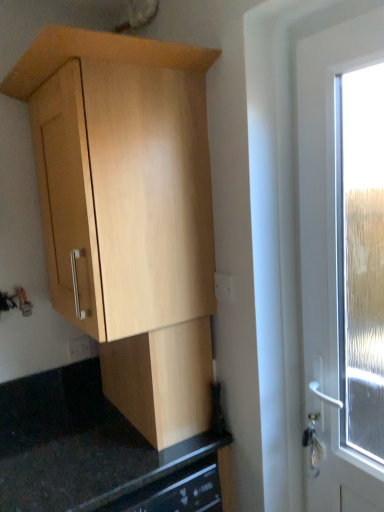
What do you see at coordinates (224, 287) in the screenshot?
I see `white plastic electric outlet at center-right, arranged as the first electric outlet when viewed from the top` at bounding box center [224, 287].

What is the approximate width of white plastic electric outlet at center-right, positioned as the second electric outlet in bottom-to-top order?

white plastic electric outlet at center-right, positioned as the second electric outlet in bottom-to-top order, is 0.61 inches in width.

Based on the photo, how much space does light wood cabinet at upper left, which ranks as the 1th cabinetry in top-to-bottom order, occupy horizontally?

47.65 centimeters.

Image resolution: width=384 pixels, height=512 pixels. I want to click on light wood cabinet at center, placed as the first cabinetry when sorted from bottom to top, so click(x=162, y=381).

I want to click on white plastic electric outlet at lower left, which is counted as the second electric outlet, starting from the top, so click(x=79, y=349).

How distant is black granite countertop at lower center from white plastic electric outlet at lower left, which is the 1th electric outlet in left-to-right order?

black granite countertop at lower center and white plastic electric outlet at lower left, which is the 1th electric outlet in left-to-right order, are 36.60 centimeters apart from each other.

From the picture: Would you say black granite countertop at lower center is inside or outside white plastic electric outlet at lower left, acting as the 2th electric outlet starting from the right?

black granite countertop at lower center cannot be found inside white plastic electric outlet at lower left, acting as the 2th electric outlet starting from the right.

Is black granite countertop at lower center wider or thinner than white plastic electric outlet at lower left, the second electric outlet in the front-to-back sequence?

black granite countertop at lower center is wider than white plastic electric outlet at lower left, the second electric outlet in the front-to-back sequence.

From a real-world perspective, is black granite countertop at lower center physically located above or below light wood cabinet at upper left, which ranks as the 1th cabinetry in top-to-bottom order?

Clearly, from a real-world perspective, black granite countertop at lower center is below light wood cabinet at upper left, which ranks as the 1th cabinetry in top-to-bottom order.

Is black granite countertop at lower center wider or thinner than light wood cabinet at upper left, which ranks as the 1th cabinetry in top-to-bottom order?

Considering their sizes, black granite countertop at lower center looks broader than light wood cabinet at upper left, which ranks as the 1th cabinetry in top-to-bottom order.

Locate an element on the screen. the 2nd cabinetry above the black granite countertop at lower center (from a real-world perspective) is located at coordinates (128, 213).

Which of these two, light wood cabinet at center, placed as the first cabinetry when sorted from bottom to top, or black granite countertop at lower center, is smaller?

light wood cabinet at center, placed as the first cabinetry when sorted from bottom to top.

Considering the sizes of objects light wood cabinet at center, placed as the first cabinetry when sorted from bottom to top, and black granite countertop at lower center in the image provided, who is thinner, light wood cabinet at center, placed as the first cabinetry when sorted from bottom to top, or black granite countertop at lower center?

light wood cabinet at center, placed as the first cabinetry when sorted from bottom to top, is thinner.

Is light wood cabinet at center, the second cabinetry positioned from the top, with black granite countertop at lower center?

No, light wood cabinet at center, the second cabinetry positioned from the top, is not making contact with black granite countertop at lower center.

Is point (114, 373) closer to camera compared to point (19, 501)?

No, (114, 373) is further to viewer.

Considering the relative sizes of light wood cabinet at center, placed as the first cabinetry when sorted from bottom to top, and white plastic electric outlet at center-right, positioned as the 2th electric outlet in left-to-right order, in the image provided, is light wood cabinet at center, placed as the first cabinetry when sorted from bottom to top, taller than white plastic electric outlet at center-right, positioned as the 2th electric outlet in left-to-right order,?

Yes.

From a real-world perspective, which object stands above the other?

white plastic electric outlet at center-right, arranged as the first electric outlet when viewed from the top, is physically above.

Considering the positions of point (183, 387) and point (223, 290), is point (183, 387) closer or farther from the camera than point (223, 290)?

Point (183, 387) is positioned farther from the camera compared to point (223, 290).

Consider the image. Which object is positioned more to the left, light wood cabinet at center, the second cabinetry positioned from the top, or white plastic electric outlet at center-right, which ranks as the first electric outlet in right-to-left order?

Positioned to the left is light wood cabinet at center, the second cabinetry positioned from the top.

Is white plastic electric outlet at lower left, acting as the 2th electric outlet starting from the right, inside the boundaries of light wood cabinet at upper left, marked as the 2th cabinetry in a bottom-to-top arrangement, or outside?

white plastic electric outlet at lower left, acting as the 2th electric outlet starting from the right, is not inside light wood cabinet at upper left, marked as the 2th cabinetry in a bottom-to-top arrangement, it's outside.

Is white plastic electric outlet at lower left, which is counted as the second electric outlet, starting from the top, wider than light wood cabinet at upper left, marked as the 2th cabinetry in a bottom-to-top arrangement?

Incorrect, the width of white plastic electric outlet at lower left, which is counted as the second electric outlet, starting from the top, does not surpass that of light wood cabinet at upper left, marked as the 2th cabinetry in a bottom-to-top arrangement.

From the image's perspective, does white plastic electric outlet at lower left, which is the 1th electric outlet in back-to-front order, appear higher than light wood cabinet at upper left, marked as the 2th cabinetry in a bottom-to-top arrangement?

No.

Based on the photo, considering the sizes of objects white plastic electric outlet at center-right, arranged as the first electric outlet when viewed from the top, and black granite countertop at lower center in the image provided, who is smaller, white plastic electric outlet at center-right, arranged as the first electric outlet when viewed from the top, or black granite countertop at lower center?

With smaller size is white plastic electric outlet at center-right, arranged as the first electric outlet when viewed from the top.

From the picture: Which object is positioned more to the right, white plastic electric outlet at center-right, positioned as the 2th electric outlet in left-to-right order, or black granite countertop at lower center?

Positioned to the right is white plastic electric outlet at center-right, positioned as the 2th electric outlet in left-to-right order.

From a real-world perspective, is white plastic electric outlet at center-right, positioned as the 1th electric outlet in front-to-back order, on black granite countertop at lower center?

Yes, from a real-world perspective, white plastic electric outlet at center-right, positioned as the 1th electric outlet in front-to-back order, is above black granite countertop at lower center.

Based on the photo, is white plastic electric outlet at center-right, positioned as the second electric outlet in bottom-to-top order, aimed at black granite countertop at lower center?

No, white plastic electric outlet at center-right, positioned as the second electric outlet in bottom-to-top order, is not facing towards black granite countertop at lower center.

Between light wood cabinet at center, placed as the first cabinetry when sorted from bottom to top, and white plastic electric outlet at lower left, which is counted as the second electric outlet, starting from the top, which one appears on the left side from the viewer's perspective?

Positioned to the left is white plastic electric outlet at lower left, which is counted as the second electric outlet, starting from the top.

Would you say light wood cabinet at center, placed as the first cabinetry when sorted from bottom to top, is inside or outside white plastic electric outlet at lower left, which ranks as the first electric outlet in bottom-to-top order?

light wood cabinet at center, placed as the first cabinetry when sorted from bottom to top, is spatially situated outside white plastic electric outlet at lower left, which ranks as the first electric outlet in bottom-to-top order.

Based on their sizes in the image, would you say light wood cabinet at center, the second cabinetry positioned from the top, is bigger or smaller than white plastic electric outlet at lower left, which is the 1th electric outlet in back-to-front order?

In the image, light wood cabinet at center, the second cabinetry positioned from the top, appears to be larger than white plastic electric outlet at lower left, which is the 1th electric outlet in back-to-front order.

I want to click on electric outlet that appears on the left of black granite countertop at lower center, so click(x=79, y=349).

This screenshot has height=512, width=384. I want to click on counter top located below the light wood cabinet at upper left, which ranks as the 1th cabinetry in top-to-bottom order (from the image's perspective), so click(x=84, y=448).

Looking at the image, which one is located further to white plastic electric outlet at center-right, which ranks as the first electric outlet in right-to-left order, light wood cabinet at upper left, which ranks as the 1th cabinetry in top-to-bottom order, or light wood cabinet at center, placed as the first cabinetry when sorted from bottom to top?

light wood cabinet at upper left, which ranks as the 1th cabinetry in top-to-bottom order.

Looking at this image, considering their positions, is white plastic electric outlet at lower left, which is the 1th electric outlet in left-to-right order, positioned further to light wood cabinet at upper left, which ranks as the 1th cabinetry in top-to-bottom order, than black granite countertop at lower center?

Among the two, white plastic electric outlet at lower left, which is the 1th electric outlet in left-to-right order, is located further to light wood cabinet at upper left, which ranks as the 1th cabinetry in top-to-bottom order.

From the image, which object appears to be nearer to white plastic electric outlet at lower left, which is the 1th electric outlet in left-to-right order, white plastic electric outlet at center-right, arranged as the first electric outlet when viewed from the top, or light wood cabinet at upper left, marked as the 2th cabinetry in a bottom-to-top arrangement?

white plastic electric outlet at center-right, arranged as the first electric outlet when viewed from the top.

Based on their spatial positions, is black granite countertop at lower center or light wood cabinet at center, placed as the first cabinetry when sorted from bottom to top, further from white plastic electric outlet at center-right, the second electric outlet from the back?

Based on the image, black granite countertop at lower center appears to be further to white plastic electric outlet at center-right, the second electric outlet from the back.

Which object lies nearer to the anchor point white plastic electric outlet at lower left, the second electric outlet in the front-to-back sequence, white plastic electric outlet at center-right, positioned as the second electric outlet in bottom-to-top order, or black granite countertop at lower center?

black granite countertop at lower center is positioned closer to the anchor white plastic electric outlet at lower left, the second electric outlet in the front-to-back sequence.

From the image, which object appears to be nearer to light wood cabinet at upper left, marked as the 2th cabinetry in a bottom-to-top arrangement, white plastic electric outlet at lower left, which is counted as the second electric outlet, starting from the top, or light wood cabinet at center, placed as the first cabinetry when sorted from bottom to top?

light wood cabinet at center, placed as the first cabinetry when sorted from bottom to top, is positioned closer to the anchor light wood cabinet at upper left, marked as the 2th cabinetry in a bottom-to-top arrangement.

Which object lies nearer to the anchor point white plastic electric outlet at center-right, the second electric outlet from the back, white plastic electric outlet at lower left, which ranks as the first electric outlet in bottom-to-top order, or light wood cabinet at upper left, which ranks as the 1th cabinetry in top-to-bottom order?

light wood cabinet at upper left, which ranks as the 1th cabinetry in top-to-bottom order, is closer to white plastic electric outlet at center-right, the second electric outlet from the back.

Looking at this image, from the image, which object appears to be nearer to white plastic electric outlet at lower left, which ranks as the first electric outlet in bottom-to-top order, light wood cabinet at upper left, marked as the 2th cabinetry in a bottom-to-top arrangement, or black granite countertop at lower center?

black granite countertop at lower center lies closer to white plastic electric outlet at lower left, which ranks as the first electric outlet in bottom-to-top order, than the other object.

You are a GUI agent. You are given a task and a screenshot of the screen. Output one action in this format:
    pyautogui.click(x=<x>, y=<y>)
    Task: Click on the cabinetry between white plastic electric outlet at center-right, positioned as the 1th electric outlet in front-to-back order, and black granite countertop at lower center in the up-down direction
    
    Given the screenshot: What is the action you would take?
    (162, 381)

At what (x,y) coordinates should I click in order to perform the action: click on electric outlet positioned between light wood cabinet at upper left, marked as the 2th cabinetry in a bottom-to-top arrangement, and white plastic electric outlet at lower left, the second electric outlet in the front-to-back sequence, from near to far. Please return your answer as a coordinate pair (x, y). Looking at the image, I should click on (224, 287).

Identify the location of cabinetry between light wood cabinet at upper left, which ranks as the 1th cabinetry in top-to-bottom order, and black granite countertop at lower center from top to bottom. This screenshot has height=512, width=384. (162, 381).

Where is `cabinetry between black granite countertop at lower center and white plastic electric outlet at lower left, which is counted as the second electric outlet, starting from the top, along the z-axis`? The height and width of the screenshot is (512, 384). cabinetry between black granite countertop at lower center and white plastic electric outlet at lower left, which is counted as the second electric outlet, starting from the top, along the z-axis is located at coordinates (162, 381).